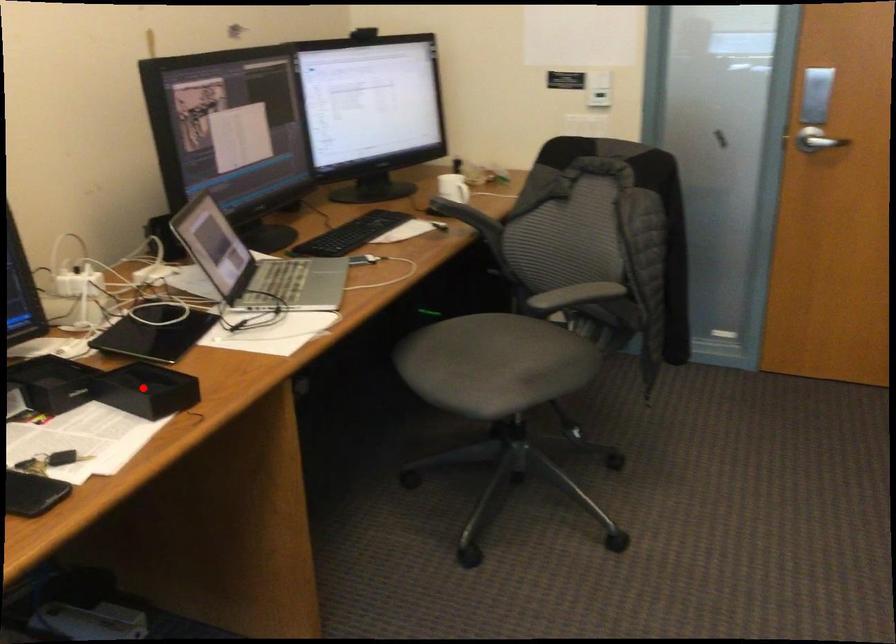
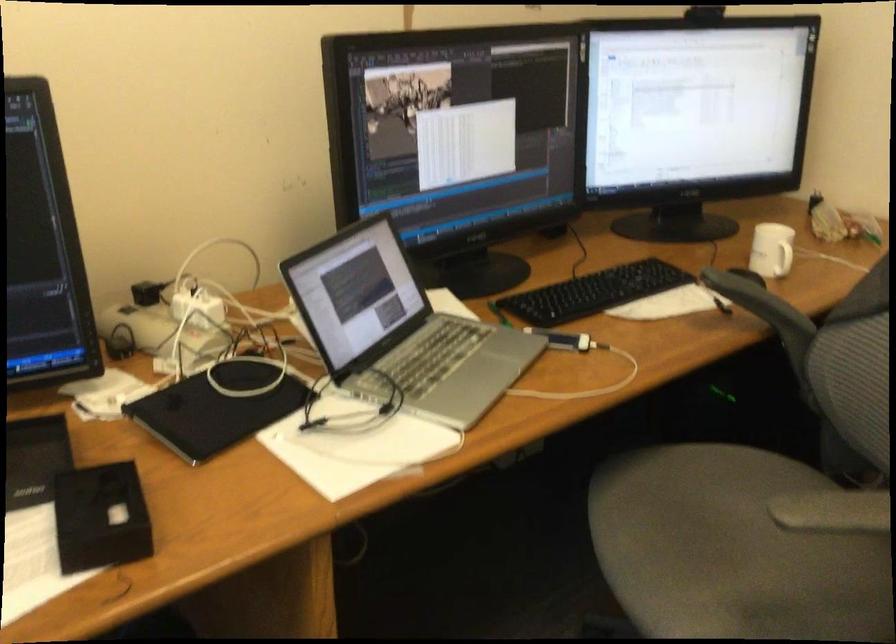
Find the pixel in the second image that matches the highlighted location in the first image.

(100, 518)